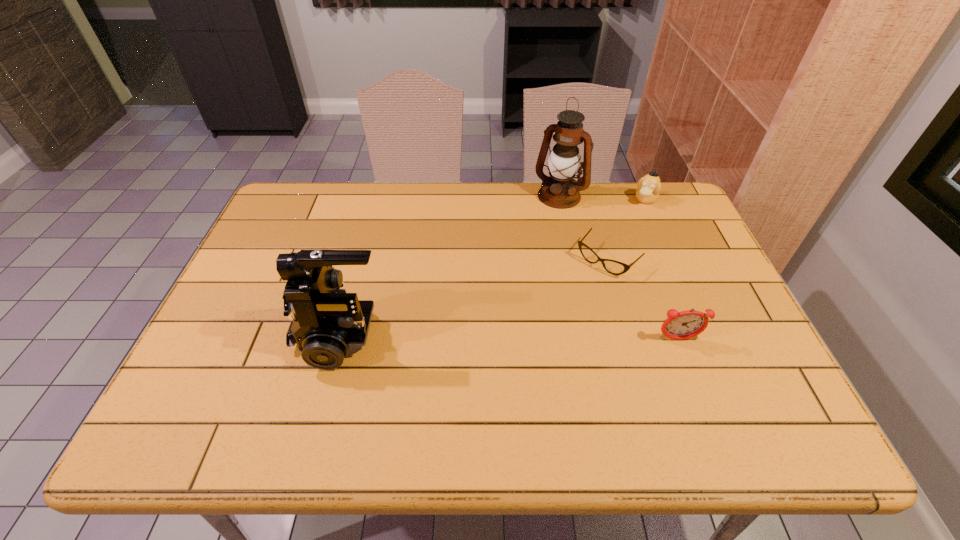
Choose which object is the second nearest neighbor to the fourth shortest object. Please provide its 2D coordinates. Your answer should be formatted as a tuple, i.e. [(x, y)], where the tuple contains the x and y coordinates of a point satisfying the conditions above.

[(559, 190)]

I want to click on object that is the fourth closest to the alarm clock, so click(327, 323).